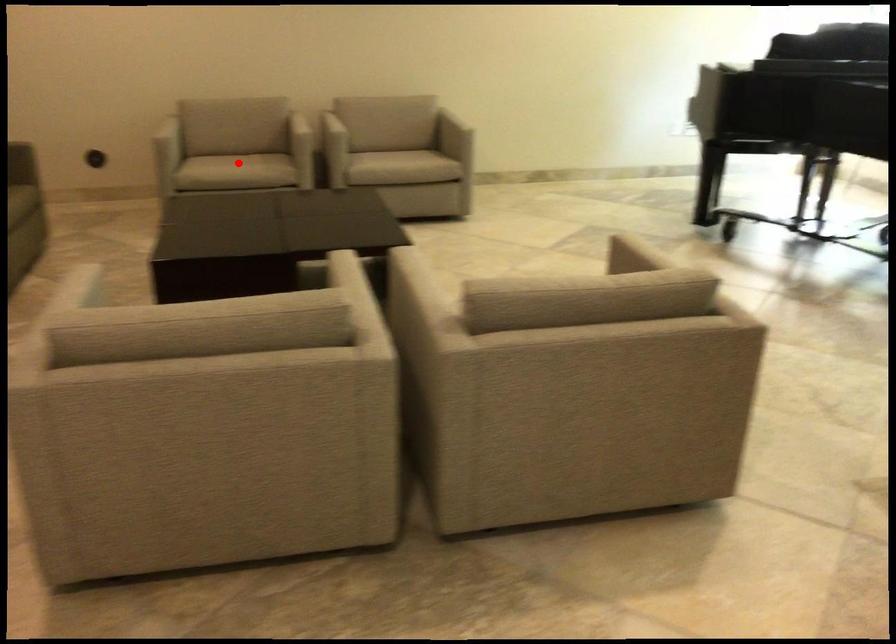
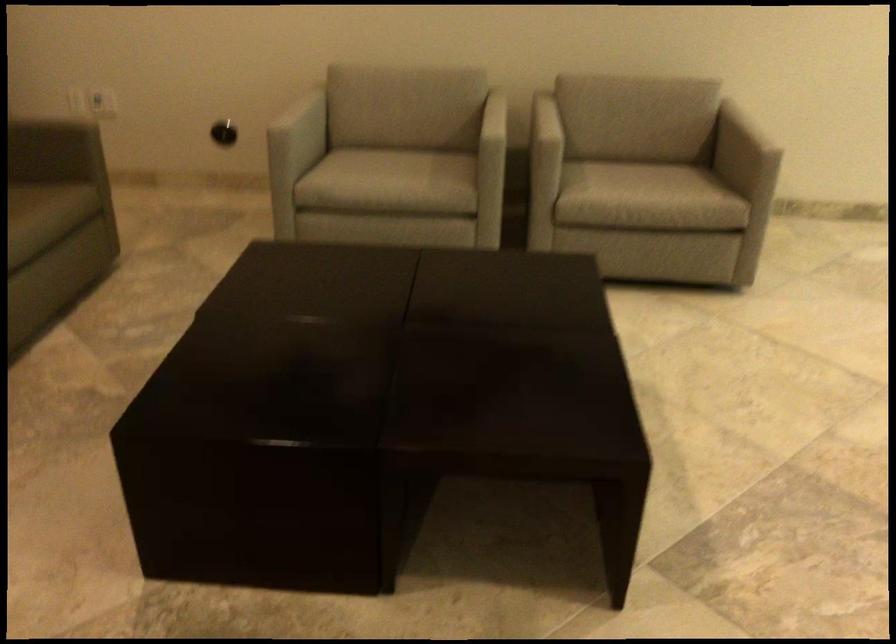
Question: I am providing you with two images of the same scene from different viewpoints. Image1 has a red point marked. In image2, the corresponding 3D location appears at what relative position? Reply with the corresponding letter.

Choices:
 (A) Closer
 (B) Farther

Answer: (A)